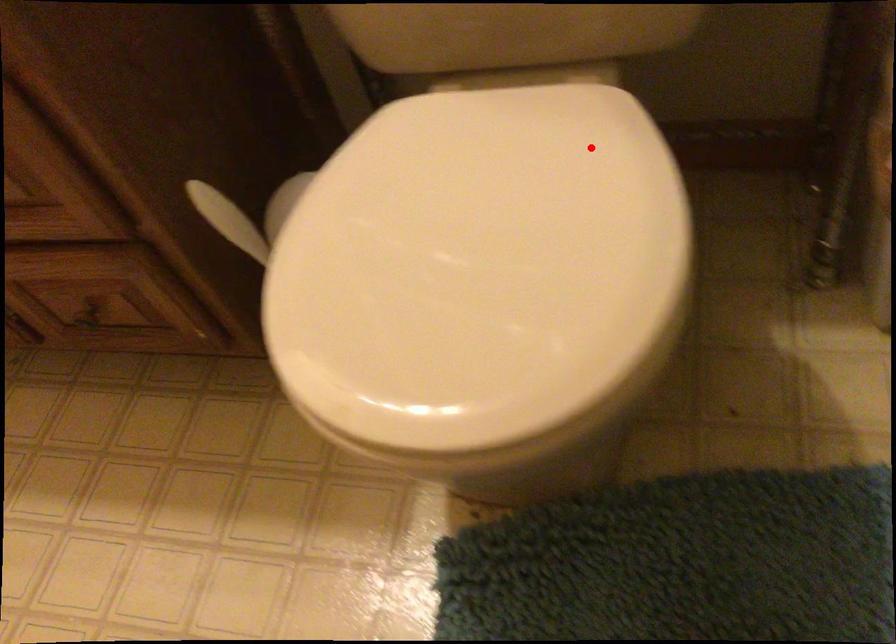
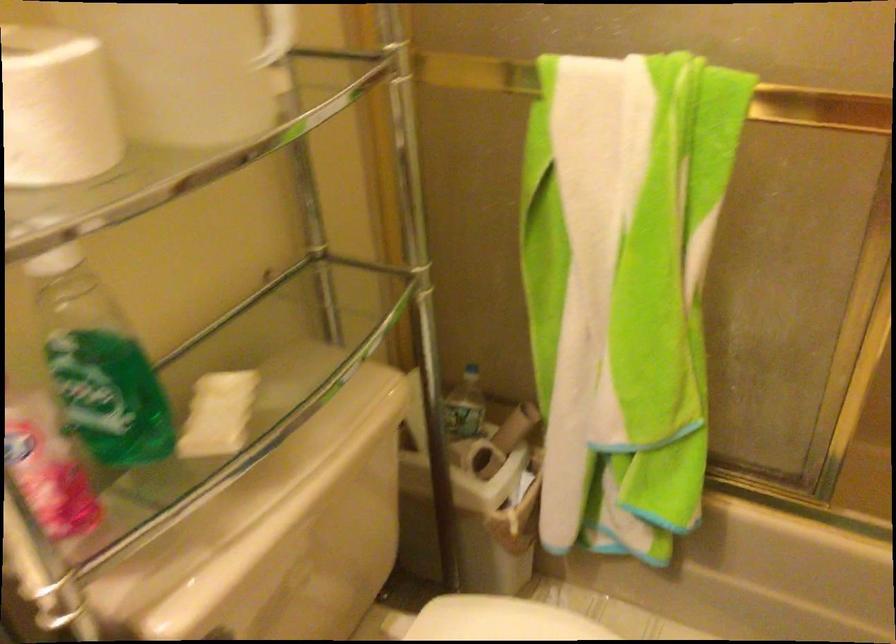
Question: I am providing you with two images of the same scene from different viewpoints. Given a red point in image1, look at the same physical point in image2. Is it:

Choices:
 (A) Closer to the viewpoint
 (B) Farther from the viewpoint

Answer: (B)